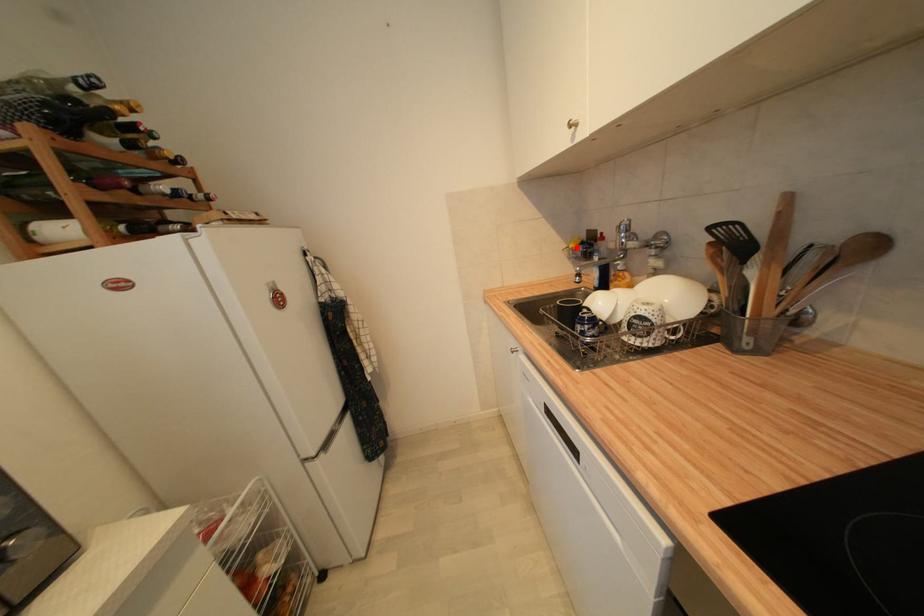
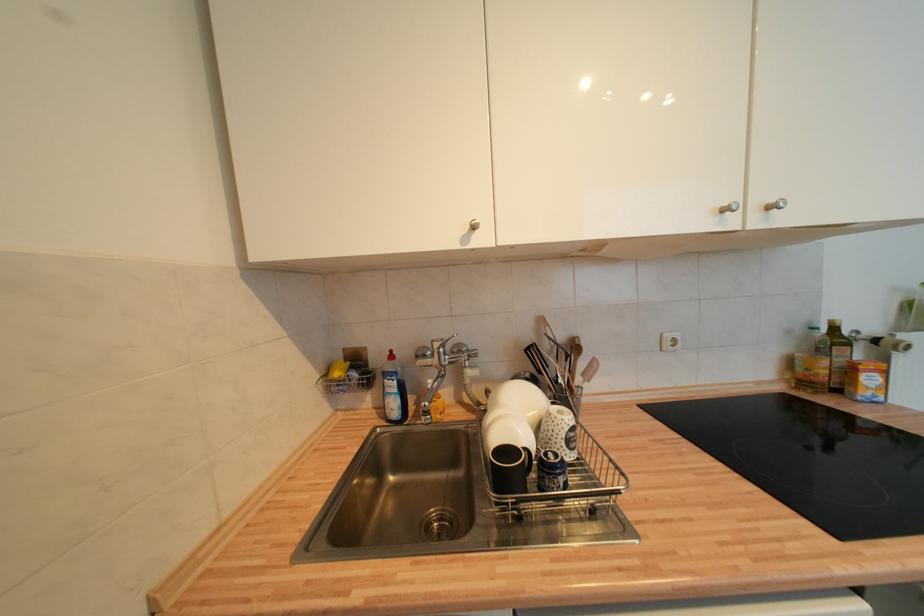
Question: A red point is marked in image1. In image2, is the corresponding 3D point closer to the camera or farther? Reply with the corresponding letter.

Choices:
 (A) The corresponding 3D point is closer.
 (B) The corresponding 3D point is farther.

Answer: (B)